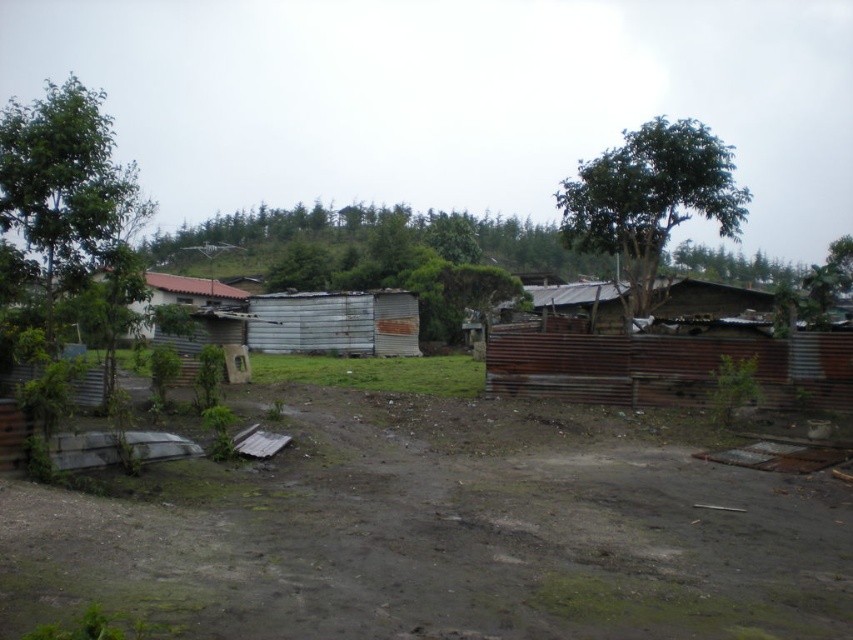
You are a delivery person with a cart that is 12 feet long. You want to park your cart along the dull brown dirt track at center. Can your cart fit along the track?

The dull brown dirt track at center is 13.30 feet from the camera. Since the cart is 12 feet long, it can fit along the track as the track is longer than the cart.

You are a hiker lost in a rural area and see the dull brown dirt track at center and the green leafy tree at upper right. Which one is closer to you?

The dull brown dirt track at center is closer to you since it is shorter than the green leafy tree at upper right.

You are a hiker who has just arrived at this rural area. You need to walk from the dull brown dirt track at center to the green leafy tree at upper right. Approximately how far will you have to walk?

The dull brown dirt track at center is 21.72 meters away from the green leafy tree at upper right, so you will have to walk approximately 21.72 meters to reach the tree.